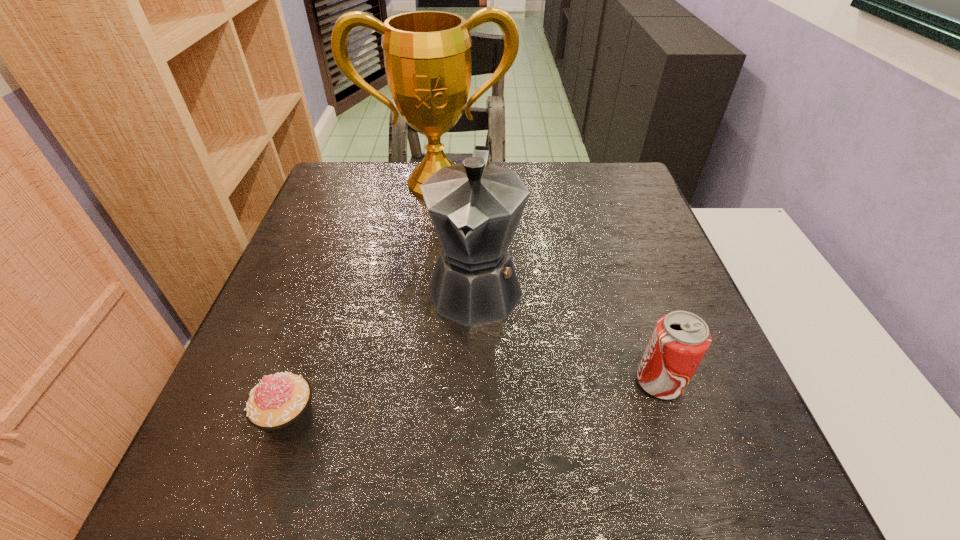
The width and height of the screenshot is (960, 540). In the image, there is a desktop. What are the coordinates of `free space at the near right corner` in the screenshot? It's located at (680, 398).

In order to click on empty space that is in between the second farthest object and the shortest object in this screenshot , I will do `click(383, 353)`.

Image resolution: width=960 pixels, height=540 pixels. Identify the location of free space that is in between the shortest object and the award. (364, 302).

Locate an element on the screen. This screenshot has width=960, height=540. free spot between the shortest object and the coffeepot is located at coordinates (383, 353).

Identify the location of free space between the third nearest object and the soda can. (567, 334).

The image size is (960, 540). I want to click on empty space between the third shortest object and the cupcake, so click(383, 353).

Image resolution: width=960 pixels, height=540 pixels. What are the coordinates of `vacant space that's between the rightmost object and the award` in the screenshot? It's located at (548, 283).

Locate an element on the screen. vacant point located between the soda can and the tallest object is located at coordinates (548, 283).

You are a GUI agent. You are given a task and a screenshot of the screen. Output one action in this format:
    pyautogui.click(x=<x>, y=<y>)
    Task: Click on the vacant space that's between the third shortest object and the soda can
    
    Given the screenshot: What is the action you would take?
    pyautogui.click(x=567, y=334)

Locate an element on the screen. Image resolution: width=960 pixels, height=540 pixels. the second closest object to the soda can is located at coordinates (280, 405).